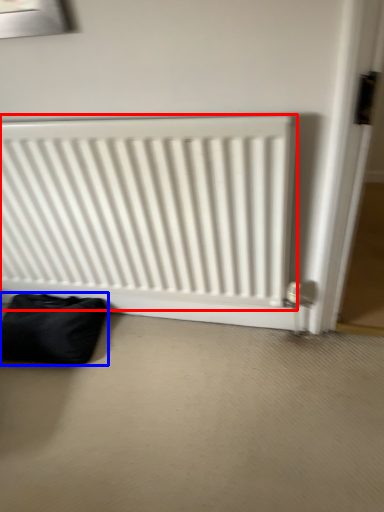
Question: Among these objects, which one is nearest to the camera, radiator (highlighted by a red box) or furniture (highlighted by a blue box)?

Choices:
 (A) radiator
 (B) furniture

Answer: (A)